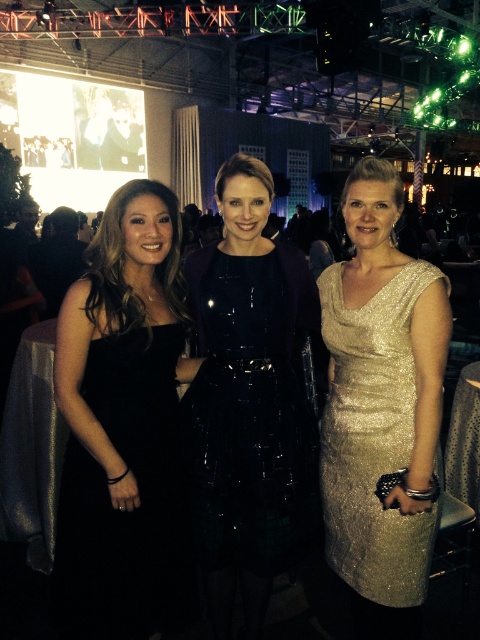
Question: Does glossy black dress at center have a larger size compared to gold sequined dress at right?

Choices:
 (A) no
 (B) yes

Answer: (B)

Question: Considering the real-world distances, which object is farthest from the glossy black dress at center?

Choices:
 (A) black satin dress at left
 (B) gold sequined dress at right

Answer: (A)

Question: In this image, where is black satin dress at left located relative to glossy black dress at center?

Choices:
 (A) left
 (B) right

Answer: (A)

Question: Is glossy black dress at center positioned behind gold sequined dress at right?

Choices:
 (A) yes
 (B) no

Answer: (A)

Question: Among these points, which one is nearest to the camera?

Choices:
 (A) (222, 456)
 (B) (141, 336)
 (C) (410, 440)

Answer: (B)

Question: Which point is closer to the camera taking this photo?

Choices:
 (A) (112, 218)
 (B) (266, 461)

Answer: (A)